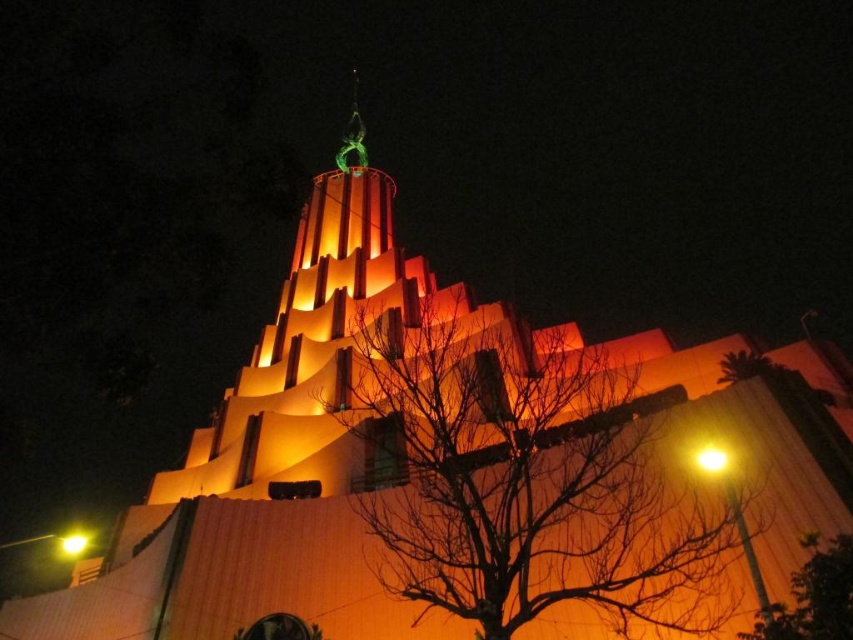
Question: Does green metallic statue at upper center have a lesser width compared to yellow matte light at upper right?

Choices:
 (A) yes
 (B) no

Answer: (B)

Question: Which of the following is the closest to the observer?

Choices:
 (A) (360, 161)
 (B) (813, 544)

Answer: (B)

Question: Estimate the real-world distances between objects in this image. Which object is closer to the bare branches at center?

Choices:
 (A) green metallic statue at upper center
 (B) yellow/golden glass streetlight at lower left
 (C) yellow matte light at upper right
 (D) green leafy tree at lower right

Answer: (D)

Question: Considering the relative positions of green metallic statue at upper center and yellow matte light at upper right in the image provided, where is green metallic statue at upper center located with respect to yellow matte light at upper right?

Choices:
 (A) below
 (B) above

Answer: (B)

Question: Which object is farther from the camera taking this photo?

Choices:
 (A) green leafy tree at lower right
 (B) yellow/golden glass streetlight at lower left
 (C) yellow matte light at upper right
 (D) bare branches at center

Answer: (B)

Question: In this image, where is green leafy tree at lower right located relative to yellow matte light at upper right?

Choices:
 (A) below
 (B) above

Answer: (A)